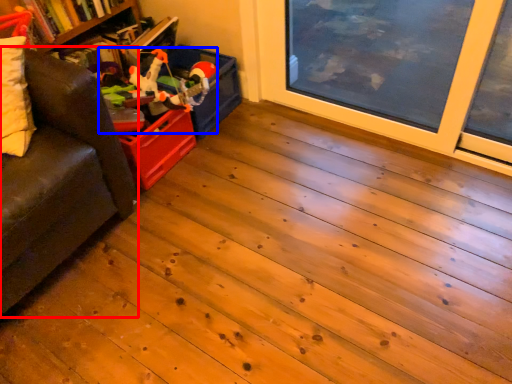
Question: Which object is closer to the camera taking this photo, studio couch (highlighted by a red box) or toy (highlighted by a blue box)?

Choices:
 (A) studio couch
 (B) toy

Answer: (A)